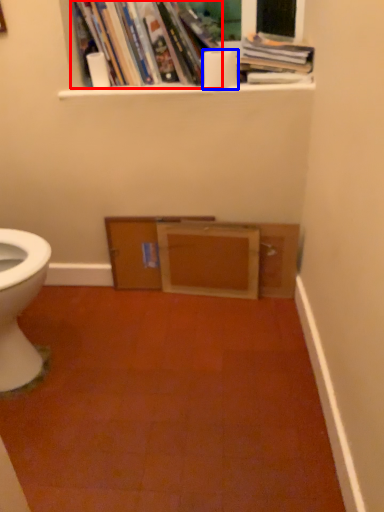
Question: Which object is closer to the camera taking this photo, book (highlighted by a red box) or toilet paper (highlighted by a blue box)?

Choices:
 (A) book
 (B) toilet paper

Answer: (A)